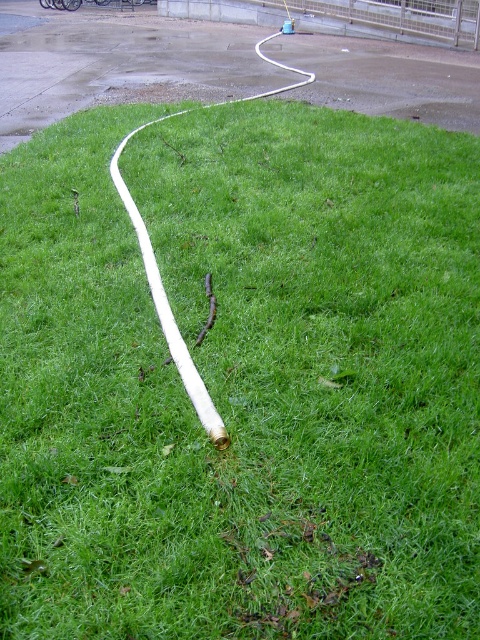
Question: Which point is closer to the camera?

Choices:
 (A) (254, 77)
 (B) (200, 416)

Answer: (B)

Question: Among these objects, which one is farthest from the camera?

Choices:
 (A) white rubber hose at upper center
 (B) white rubber hose at center

Answer: (A)

Question: Does white rubber hose at upper center lie in front of white rubber hose at center?

Choices:
 (A) no
 (B) yes

Answer: (A)

Question: Does white rubber hose at upper center lie behind white rubber hose at center?

Choices:
 (A) yes
 (B) no

Answer: (A)

Question: Does white rubber hose at upper center come behind white rubber hose at center?

Choices:
 (A) no
 (B) yes

Answer: (B)